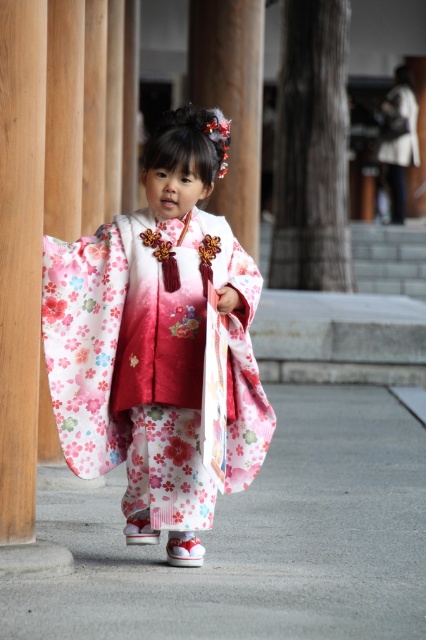
In the scene shown: You are standing in front of the wooden structure at the temple or shrine and see two points marked in the image. The first point is at coordinates point (69,531) and the second point is at point (245,260). Which point is closer to you?

Point (245,260) is closer to you because it is in front of point (69,531).

You are standing in a traditional Japanese shrine and notice the white concrete pavement at center and the floral silk kimono at center. Which object is positioned to the left of the other?

The white concrete pavement at center is to the left of the floral silk kimono at center.

You are standing on the white concrete pavement at center and want to reach the floral silk kimono at center. Is the kimono located in front of or behind you?

The white concrete pavement at center is closer to the viewer than floral silk kimono at center, so the kimono is behind you.